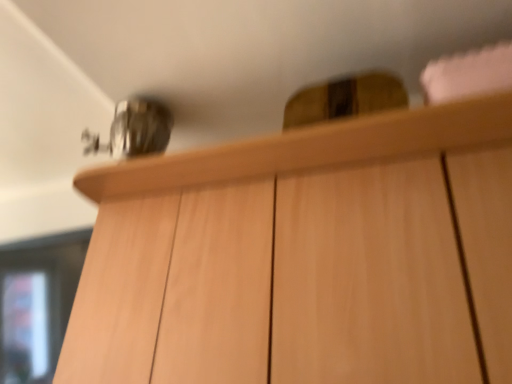
Question: Looking at the image, does light wood cabinet at upper center seem bigger or smaller compared to transparent glass door at lower left?

Choices:
 (A) small
 (B) big

Answer: (B)

Question: Do you think light wood cabinet at upper center is within transparent glass door at lower left, or outside of it?

Choices:
 (A) outside
 (B) inside

Answer: (A)

Question: Considering the positions of point (217, 274) and point (47, 254), is point (217, 274) closer or farther from the camera than point (47, 254)?

Choices:
 (A) farther
 (B) closer

Answer: (B)

Question: Is transparent glass door at lower left situated inside light wood cabinet at upper center or outside?

Choices:
 (A) outside
 (B) inside

Answer: (A)

Question: From their relative heights in the image, would you say transparent glass door at lower left is taller or shorter than light wood cabinet at upper center?

Choices:
 (A) tall
 (B) short

Answer: (B)

Question: From a real-world perspective, is transparent glass door at lower left physically located above or below light wood cabinet at upper center?

Choices:
 (A) below
 (B) above

Answer: (A)

Question: Is point [x=29, y=281] closer or farther from the camera than point [x=283, y=233]?

Choices:
 (A) farther
 (B) closer

Answer: (A)